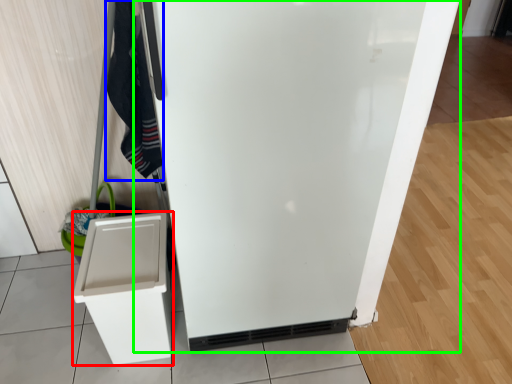
Question: Considering the real-world distances, which object is farthest from cabinetry (highlighted by a red box)? clothing (highlighted by a blue box) or refrigerator (highlighted by a green box)?

Choices:
 (A) clothing
 (B) refrigerator

Answer: (B)